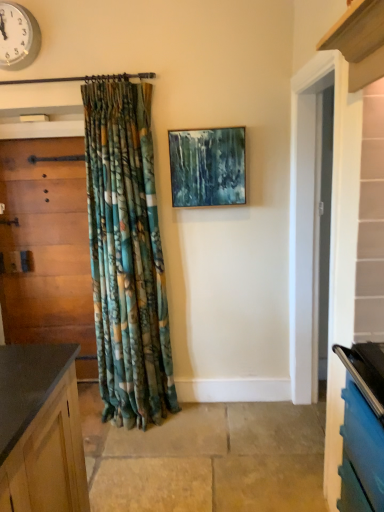
Identify the location of teal acrylic painting at center. (207, 167).

Identify the location of metallic clock at upper left. The width and height of the screenshot is (384, 512). (18, 37).

The width and height of the screenshot is (384, 512). What are the coordinates of `teal acrylic painting at center` in the screenshot? It's located at (207, 167).

Considering the relative sizes of wooden door at left and metallic clock at upper left in the image provided, is wooden door at left shorter than metallic clock at upper left?

No, wooden door at left is not shorter than metallic clock at upper left.

Is wooden door at left inside the boundaries of metallic clock at upper left, or outside?

The correct answer is: outside.

Considering the sizes of objects wooden door at left and metallic clock at upper left in the image provided, who is thinner, wooden door at left or metallic clock at upper left?

metallic clock at upper left.

Which is further, (10, 58) or (32, 303)?

The point (32, 303) is farther.

Is metallic clock at upper left in front of or behind wooden door at left in the image?

metallic clock at upper left is in front of wooden door at left.

Looking at this image, would you say metallic clock at upper left is outside wooden door at left?

metallic clock at upper left lies outside wooden door at left's area.

From a real-world perspective, between metallic clock at upper left and wooden door at left, who is vertically lower?

In real-world perspective, wooden door at left is lower.

Which is closer, [223,132] or [2,49]?

Clearly, point [223,132] is more distant from the camera than point [2,49].

Is teal acrylic painting at center looking in the opposite direction of metallic clock at upper left?

No, teal acrylic painting at center is not facing the opposite direction of metallic clock at upper left.

From the image's perspective, would you say teal acrylic painting at center is positioned over metallic clock at upper left?

Incorrect, from the image's perspective, teal acrylic painting at center is lower than metallic clock at upper left.

Which object is thinner, metallic clock at upper left or teal acrylic painting at center?

With smaller width is metallic clock at upper left.

Is metallic clock at upper left oriented away from teal acrylic painting at center?

No, metallic clock at upper left is not facing away from teal acrylic painting at center.

Does point (27, 30) come closer to viewer compared to point (176, 141)?

Yes, it is.

From a real-world perspective, is metallic clock at upper left under teal acrylic painting at center?

No.

In the scene shown: Does wooden door at left have a larger size compared to teal acrylic painting at center?

Correct, wooden door at left is larger in size than teal acrylic painting at center.

From a real-world perspective, which is physically above, wooden door at left or teal acrylic painting at center?

In real-world perspective, teal acrylic painting at center is above.

Can you confirm if wooden door at left is wider than teal acrylic painting at center?

Indeed, wooden door at left has a greater width compared to teal acrylic painting at center.

Is wooden door at left taller than teal acrylic painting at center?

Indeed, wooden door at left has a greater height compared to teal acrylic painting at center.

In the scene shown: Who is bigger, teal acrylic painting at center or wooden door at left?

Bigger between the two is wooden door at left.

Looking at this image, is teal acrylic painting at center positioned beyond the bounds of wooden door at left?

teal acrylic painting at center lies outside wooden door at left's area.

Which object is thinner, teal acrylic painting at center or wooden door at left?

teal acrylic painting at center is thinner.

Where is `door on the left of metallic clock at upper left`? The image size is (384, 512). door on the left of metallic clock at upper left is located at coordinates (47, 249).

This screenshot has width=384, height=512. What are the coordinates of `clock lying in front of the wooden door at left` in the screenshot? It's located at (18, 37).

Estimate the real-world distances between objects in this image. Which object is further from teal acrylic painting at center, wooden door at left or metallic clock at upper left?

metallic clock at upper left lies further to teal acrylic painting at center than the other object.

Which object lies further to the anchor point teal acrylic painting at center, metallic clock at upper left or wooden door at left?

metallic clock at upper left lies further to teal acrylic painting at center than the other object.

Estimate the real-world distances between objects in this image. Which object is further from wooden door at left, teal acrylic painting at center or metallic clock at upper left?

teal acrylic painting at center is positioned further to the anchor wooden door at left.

From the picture: Looking at the image, which one is located further to metallic clock at upper left, wooden door at left or teal acrylic painting at center?

teal acrylic painting at center is positioned further to the anchor metallic clock at upper left.

Based on their spatial positions, is metallic clock at upper left or teal acrylic painting at center further from wooden door at left?

teal acrylic painting at center is positioned further to the anchor wooden door at left.

Considering their positions, is teal acrylic painting at center positioned further to metallic clock at upper left than wooden door at left?

Among the two, teal acrylic painting at center is located further to metallic clock at upper left.

At what (x,y) coordinates should I click in order to perform the action: click on picture frame between metallic clock at upper left and wooden door at left in the up-down direction. Please return your answer as a coordinate pair (x, y). The width and height of the screenshot is (384, 512). Looking at the image, I should click on (207, 167).